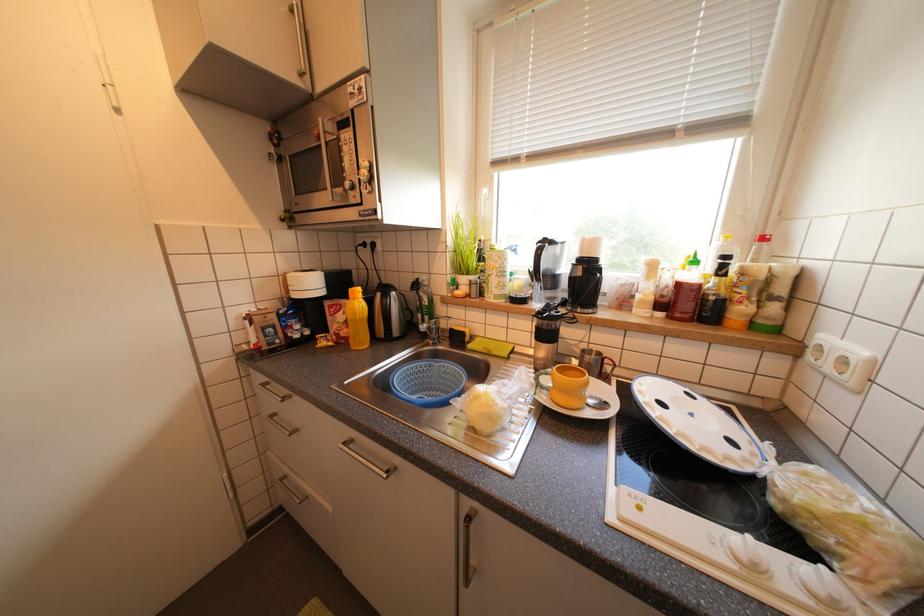
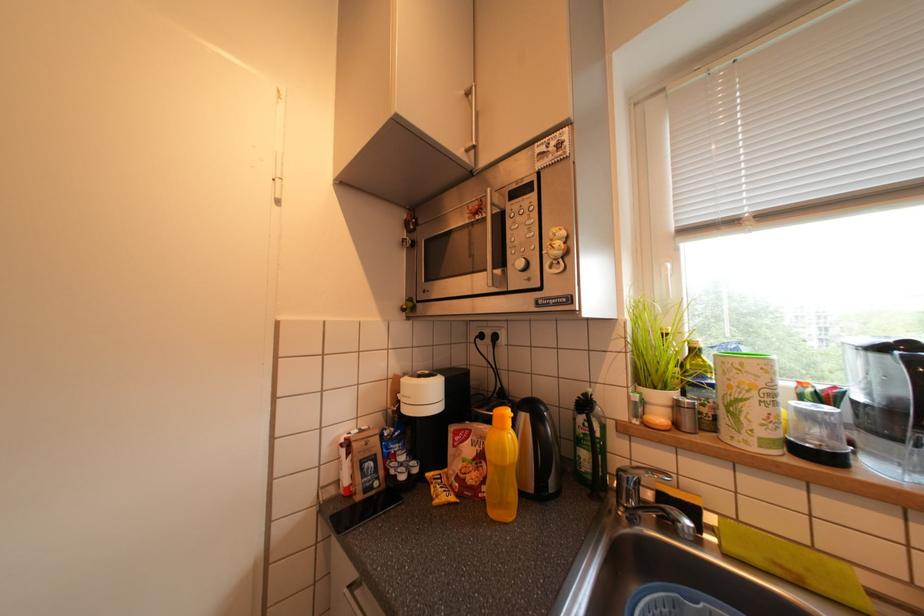
Looking at this image, what movement of the cameraman would produce the second image?

The cameraman moved toward left, forward.